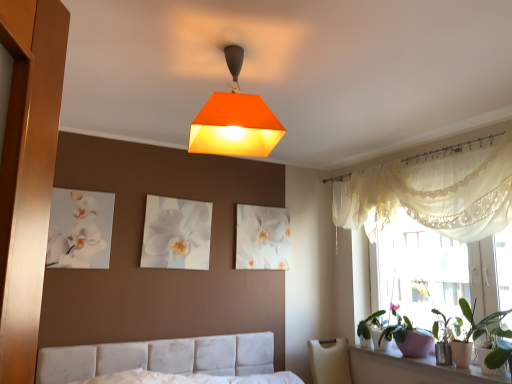
Question: Does white fabric bed at lower center appear on the left side of white lace curtain at upper right?

Choices:
 (A) no
 (B) yes

Answer: (B)

Question: Does white fabric bed at lower center come in front of white lace curtain at upper right?

Choices:
 (A) no
 (B) yes

Answer: (B)

Question: Considering the relative positions of white fabric bed at lower center and white lace curtain at upper right in the image provided, is white fabric bed at lower center to the right of white lace curtain at upper right from the viewer's perspective?

Choices:
 (A) no
 (B) yes

Answer: (A)

Question: From a real-world perspective, is white fabric bed at lower center positioned under white lace curtain at upper right based on gravity?

Choices:
 (A) no
 (B) yes

Answer: (B)

Question: Considering the relative sizes of white fabric bed at lower center and white lace curtain at upper right in the image provided, is white fabric bed at lower center thinner than white lace curtain at upper right?

Choices:
 (A) no
 (B) yes

Answer: (A)

Question: Is the position of white fabric bed at lower center more distant than that of white lace curtain at upper right?

Choices:
 (A) no
 (B) yes

Answer: (A)

Question: Can you confirm if white ceramic window sill at lower right is taller than white lace curtain at upper right?

Choices:
 (A) no
 (B) yes

Answer: (A)

Question: Is white ceramic window sill at lower right shorter than white lace curtain at upper right?

Choices:
 (A) no
 (B) yes

Answer: (B)

Question: From a real-world perspective, is white ceramic window sill at lower right located beneath white lace curtain at upper right?

Choices:
 (A) yes
 (B) no

Answer: (A)

Question: Is white ceramic window sill at lower right in front of white lace curtain at upper right?

Choices:
 (A) yes
 (B) no

Answer: (B)

Question: Is white ceramic window sill at lower right positioned beyond the bounds of white lace curtain at upper right?

Choices:
 (A) no
 (B) yes

Answer: (B)

Question: Is white ceramic window sill at lower right to the right of white lace curtain at upper right from the viewer's perspective?

Choices:
 (A) yes
 (B) no

Answer: (A)

Question: Is green matte plant at right closer to the viewer compared to white glossy canvas at upper left, placed as the 1th picture frame when sorted from front to back?

Choices:
 (A) yes
 (B) no

Answer: (A)